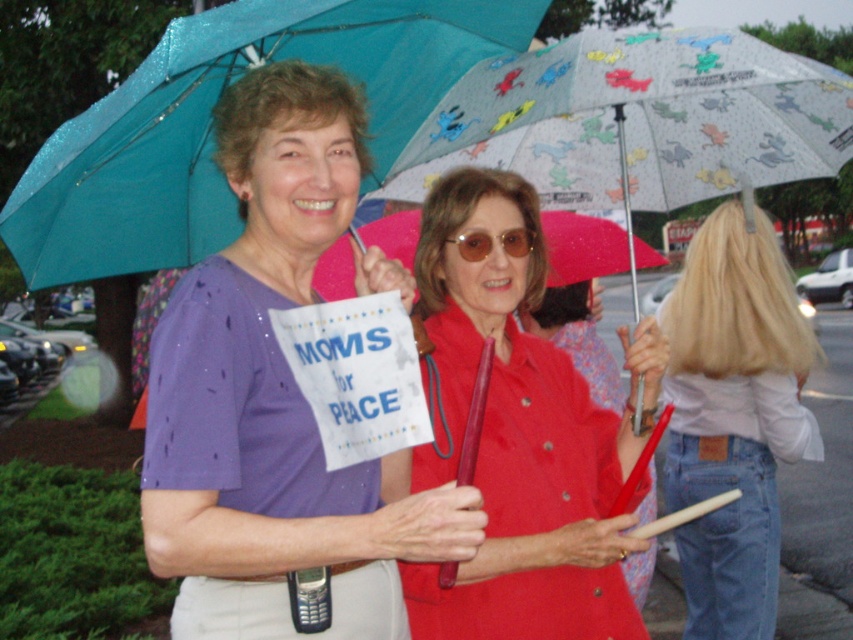
Question: Can you confirm if blonde hair at upper right is positioned above sunglassesmatte at center?

Choices:
 (A) yes
 (B) no

Answer: (B)

Question: Is matte red shirt at center thinner than blonde hair at upper right?

Choices:
 (A) no
 (B) yes

Answer: (B)

Question: Which object is positioned closest to the purple fabric shirt at upper left?

Choices:
 (A) matte red shirt at center
 (B) teal fabric umbrella at upper left
 (C) sunglassesmatte at center

Answer: (A)

Question: Estimate the real-world distances between objects in this image. Which object is farther from the sunglassesmatte at center?

Choices:
 (A) purple fabric shirt at upper left
 (B) blonde hair at upper right
 (C) teal fabric umbrella at upper left

Answer: (B)

Question: Does purple fabric shirt at upper left appear under blonde hair at upper right?

Choices:
 (A) yes
 (B) no

Answer: (B)

Question: Which point is closer to the camera?

Choices:
 (A) (200, 180)
 (B) (686, 307)
 (C) (468, 243)
 (D) (350, 541)

Answer: (D)